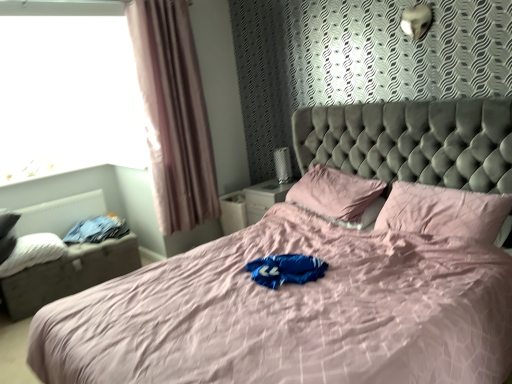
Question: Considering the relative sizes of white soft pillow at left, the third pillow from the right, and pink fabric bed at center in the image provided, is white soft pillow at left, the third pillow from the right, bigger than pink fabric bed at center?

Choices:
 (A) no
 (B) yes

Answer: (A)

Question: Is white soft pillow at left, the third pillow from the right, not near pink fabric bed at center?

Choices:
 (A) no
 (B) yes

Answer: (B)

Question: Does white soft pillow at left, the first pillow from the left, have a lesser height compared to pink fabric bed at center?

Choices:
 (A) yes
 (B) no

Answer: (A)

Question: Is white soft pillow at left, the first pillow from the left, not inside pink fabric bed at center?

Choices:
 (A) no
 (B) yes

Answer: (B)

Question: Does white soft pillow at left, the first pillow from the left, appear on the right side of pink fabric bed at center?

Choices:
 (A) no
 (B) yes

Answer: (A)

Question: Is white soft pillow at left, the third pillow from the right, oriented towards pink fabric bed at center?

Choices:
 (A) no
 (B) yes

Answer: (B)

Question: Is pink fabric pillow at center, which is the 2th pillow from right to left, completely or partially inside denim jeans at left?

Choices:
 (A) no
 (B) yes

Answer: (A)

Question: Is the position of denim jeans at left more distant than that of pink fabric pillow at center, which is counted as the second pillow, starting from the left?

Choices:
 (A) no
 (B) yes

Answer: (B)

Question: Does denim jeans at left have a lesser width compared to pink fabric pillow at center, which is the 2th pillow from right to left?

Choices:
 (A) yes
 (B) no

Answer: (B)

Question: Can we say denim jeans at left lies outside pink fabric pillow at center, which is the 2th pillow from right to left?

Choices:
 (A) yes
 (B) no

Answer: (A)

Question: From a real-world perspective, is denim jeans at left physically above pink fabric pillow at center, which is the 2th pillow from right to left?

Choices:
 (A) no
 (B) yes

Answer: (A)

Question: Would you say denim jeans at left is a long distance from pink fabric pillow at center, which is the 2th pillow from right to left?

Choices:
 (A) no
 (B) yes

Answer: (B)

Question: Does pink fabric pillow at center, which is counted as the second pillow, starting from the left, appear on the right side of pink fabric pillow at upper right, positioned as the first pillow in right-to-left order?

Choices:
 (A) yes
 (B) no

Answer: (B)